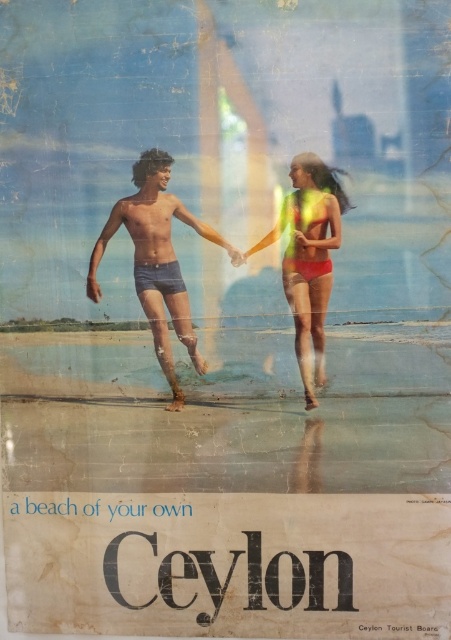
Is blue denim shorts at center to the left of matte yellow bikini at center from the viewer's perspective?

Correct, you'll find blue denim shorts at center to the left of matte yellow bikini at center.

Which is above, blue denim shorts at center or matte yellow bikini at center?

blue denim shorts at center is higher up.

Is point (156, 250) behind point (328, 289)?

Yes, point (156, 250) is behind point (328, 289).

You are a GUI agent. You are given a task and a screenshot of the screen. Output one action in this format:
    pyautogui.click(x=<x>, y=<y>)
    Task: Click on the blue denim shorts at center
    
    Given the screenshot: What is the action you would take?
    pyautogui.click(x=157, y=260)